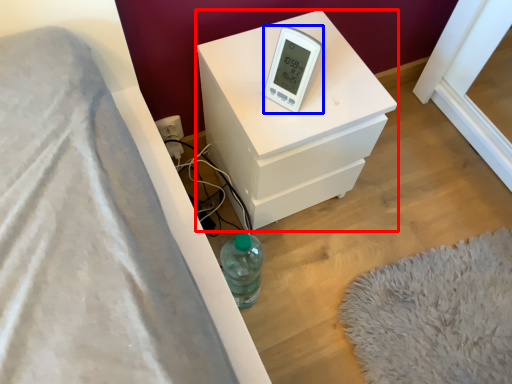
Question: Which object appears farthest to the camera in this image, nightstand (highlighted by a red box) or thermometer (highlighted by a blue box)?

Choices:
 (A) nightstand
 (B) thermometer

Answer: (A)